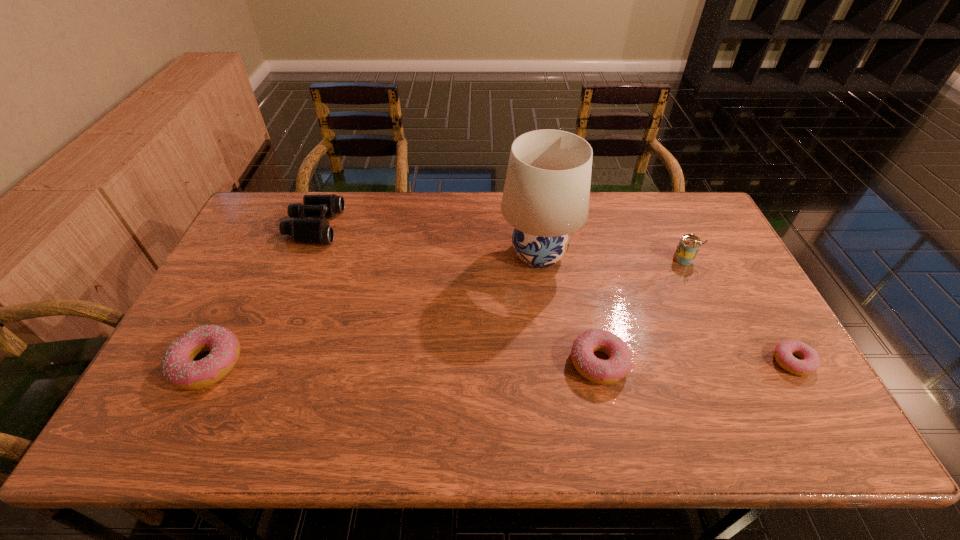
Find the location of a particular element. This screenshot has width=960, height=540. empty space between the leftmost doughnut and the rightmost doughnut is located at coordinates coord(500,363).

At what (x,y) coordinates should I click in order to perform the action: click on vacant space that's between the second doughnut from left to right and the can. Please return your answer as a coordinate pair (x, y). Looking at the image, I should click on (641, 311).

Locate an element on the screen. This screenshot has width=960, height=540. the second closest object to the rightmost object is located at coordinates click(599, 371).

Locate which object is the third closest to the leftmost doughnut. Please provide its 2D coordinates. Your answer should be formatted as a tuple, i.e. [(x, y)], where the tuple contains the x and y coordinates of a point satisfying the conditions above.

[(599, 371)]

The height and width of the screenshot is (540, 960). Find the location of `doughnut that stands as the closest to the second doughnut from right to left`. doughnut that stands as the closest to the second doughnut from right to left is located at coordinates (810, 362).

This screenshot has width=960, height=540. Identify the location of doughnut object that ranks as the second closest to the second doughnut from right to left. (178, 366).

Where is `free location that satisfies the following two spatial constraints: 1. on the back side of the second object from right to left; 2. on the front-facing side of the third tallest object`? The height and width of the screenshot is (540, 960). free location that satisfies the following two spatial constraints: 1. on the back side of the second object from right to left; 2. on the front-facing side of the third tallest object is located at coordinates (668, 226).

Identify the location of free region that satisfies the following two spatial constraints: 1. on the front-facing side of the lampshade; 2. on the back side of the shortest doughnut. (553, 362).

At what (x,y) coordinates should I click in order to perform the action: click on blank space that satisfies the following two spatial constraints: 1. on the back side of the rightmost doughnut; 2. on the front-facing side of the lampshade. Please return your answer as a coordinate pair (x, y). The width and height of the screenshot is (960, 540). Looking at the image, I should click on click(731, 254).

Find the location of `free space that satisfies the following two spatial constraints: 1. on the front-facing side of the shortest doughnut; 2. on the right side of the lampshade`. free space that satisfies the following two spatial constraints: 1. on the front-facing side of the shortest doughnut; 2. on the right side of the lampshade is located at coordinates (553, 362).